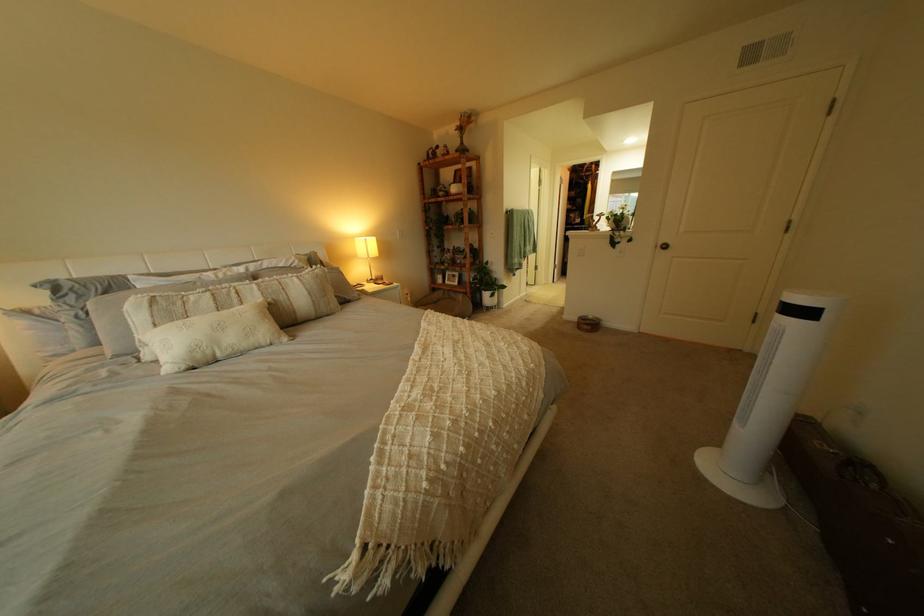
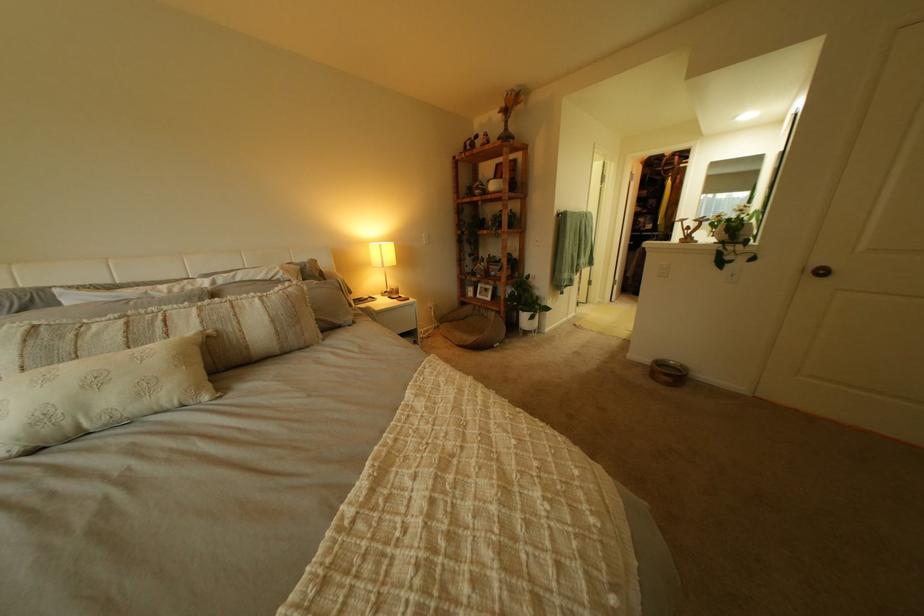
In the second image, find the point that corresponds to pixel 591 320 in the first image.

(663, 362)